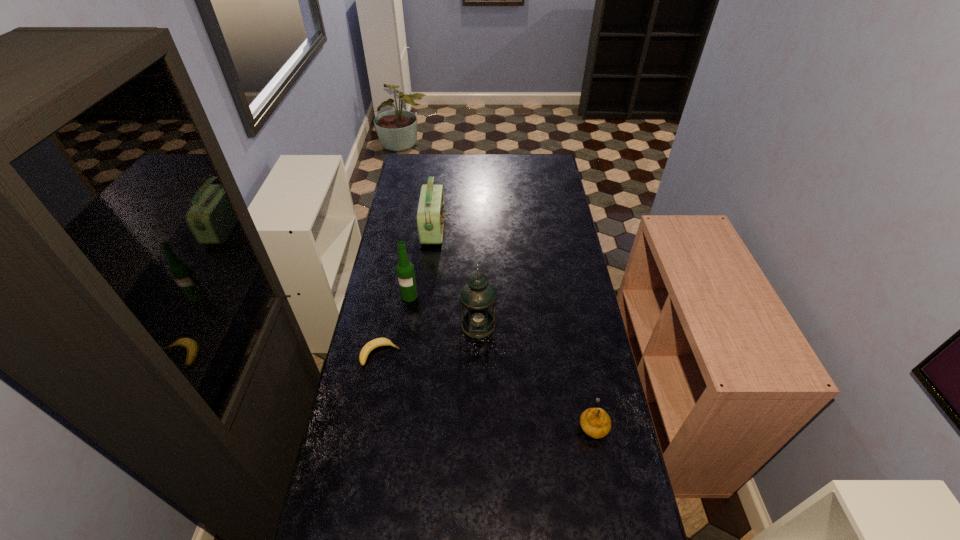
Identify the location of vacant position in the image that satisfies the following two spatial constraints: 1. on the label of the nearest object; 2. on the right side of the fourth nearest object. The width and height of the screenshot is (960, 540). (390, 424).

The image size is (960, 540). In order to click on vacant region that satisfies the following two spatial constraints: 1. on the front panel of the oil lamp; 2. on the left side of the farthest object in this screenshot , I will do `click(422, 325)`.

Where is `vacant space that satisfies the following two spatial constraints: 1. on the front panel of the fourth tallest object; 2. on the left side of the third tallest object`? The width and height of the screenshot is (960, 540). vacant space that satisfies the following two spatial constraints: 1. on the front panel of the fourth tallest object; 2. on the left side of the third tallest object is located at coordinates (411, 424).